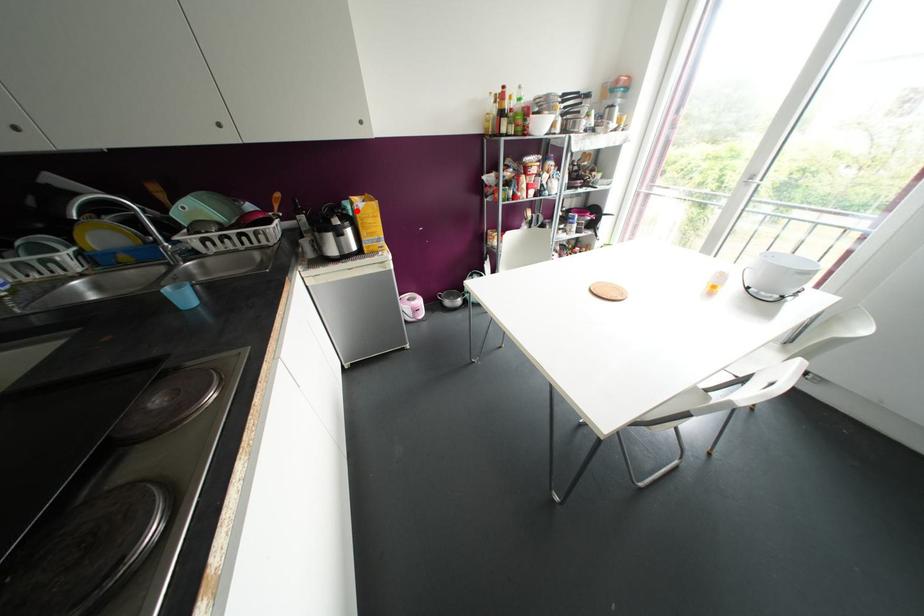
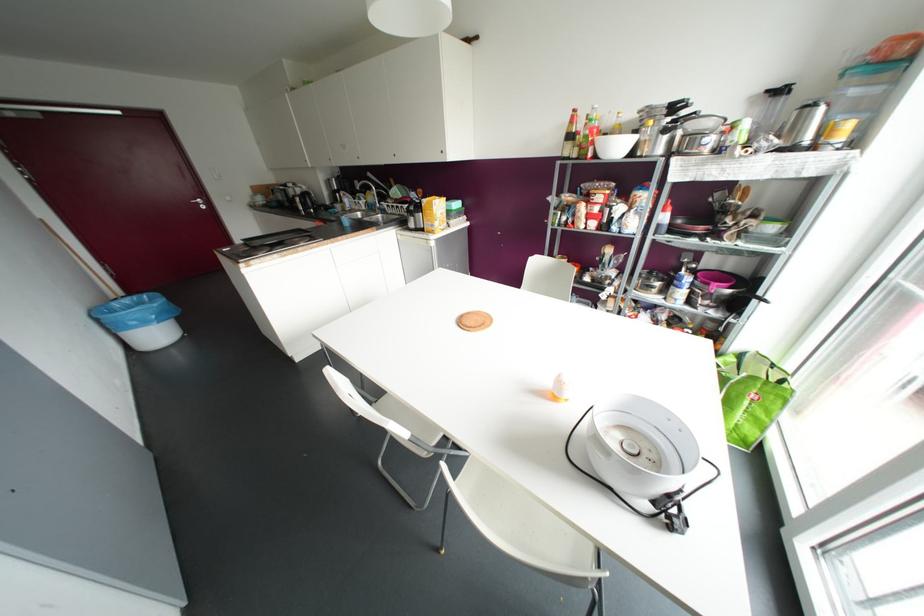
Where in the second image is the point corresponding to the highlighted location from the first image?

(421, 204)